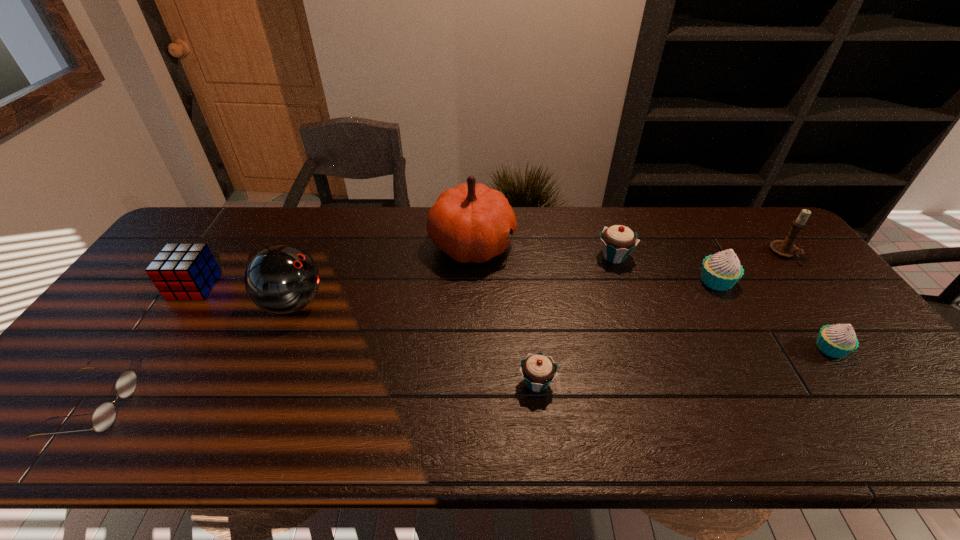
The height and width of the screenshot is (540, 960). Find the location of `the tallest object`. the tallest object is located at coordinates (471, 222).

This screenshot has width=960, height=540. I want to click on pumpkin, so click(471, 222).

What are the coordinates of `bowling ball` in the screenshot? It's located at (281, 279).

Image resolution: width=960 pixels, height=540 pixels. What are the coordinates of `the third object from left to right` in the screenshot? It's located at (281, 279).

The image size is (960, 540). I want to click on candle holder, so tap(785, 248).

Identify the location of the third object from right to left. pyautogui.click(x=721, y=271).

Where is `the farther white cupcake`? This screenshot has width=960, height=540. the farther white cupcake is located at coordinates (721, 271).

Image resolution: width=960 pixels, height=540 pixels. Identify the location of the bigger teal cupcake. (618, 241).

At what (x,y) coordinates should I click in order to perform the action: click on the third cupcake from right to left. Please return your answer as a coordinate pair (x, y). This screenshot has width=960, height=540. Looking at the image, I should click on (618, 241).

Identify the location of cube. Image resolution: width=960 pixels, height=540 pixels. (186, 271).